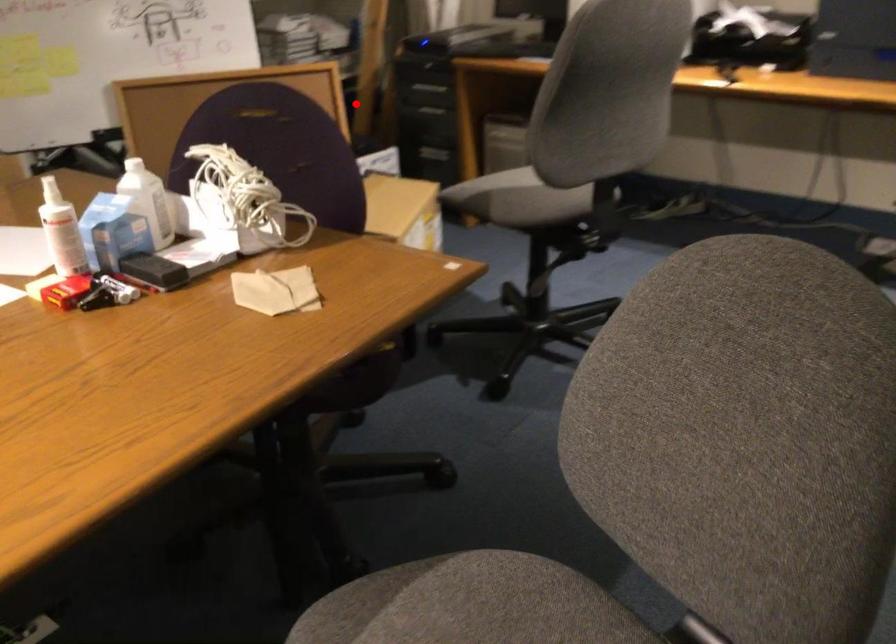
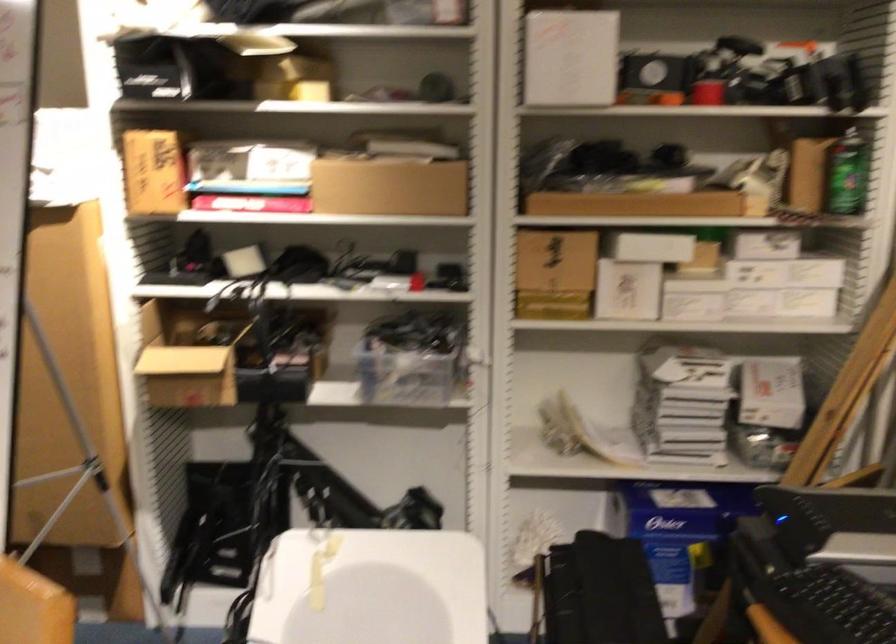
Question: I am providing you with two images of the same scene from different viewpoints. A red point is shown in image1. For the corresponding object point in image2, is it positioned nearer or farther from the camera?

Choices:
 (A) Nearer
 (B) Farther

Answer: (A)